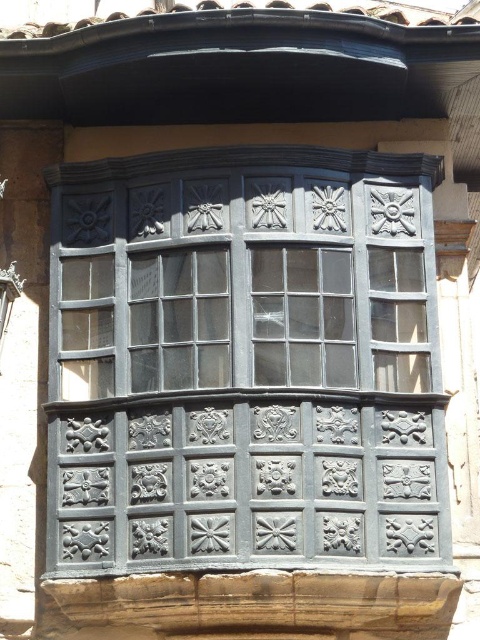
You are an architect examining the building facade. You notice the matte black window frame at center and the clear glass window at center. Which one is positioned lower in the structure?

The matte black window frame at center is positioned lower than the clear glass window at center since it is below it.

You are an architect examining the building facade. You notice the matte black window frame at center and the clear glass window at center. Which one is located to the left?

The matte black window frame at center is positioned on the left side of clear glass window at center, so the matte black window frame at center is located to the left.